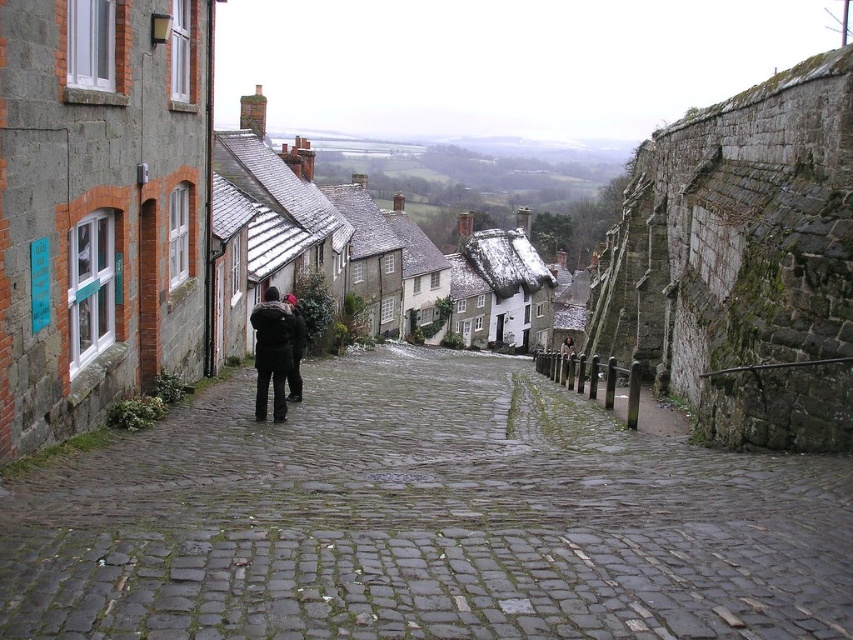
Question: Which point is closer to the camera?

Choices:
 (A) (277, 403)
 (B) (640, 573)

Answer: (B)

Question: Is rough cobblestone alley at center smaller than black fabric jacket at center?

Choices:
 (A) yes
 (B) no

Answer: (B)

Question: Which of the following is the closest to the observer?

Choices:
 (A) rough cobblestone alley at center
 (B) dark brown leather jacket at center
 (C) black fabric jacket at center

Answer: (A)

Question: From the image, what is the correct spatial relationship of rough cobblestone alley at center in relation to black fabric jacket at center?

Choices:
 (A) left
 (B) right

Answer: (B)

Question: Considering the real-world distances, which object is closest to the black fabric jacket at center?

Choices:
 (A) dark brown leather jacket at center
 (B) rough cobblestone alley at center

Answer: (A)

Question: Is the position of rough cobblestone alley at center more distant than that of dark brown leather jacket at center?

Choices:
 (A) no
 (B) yes

Answer: (A)